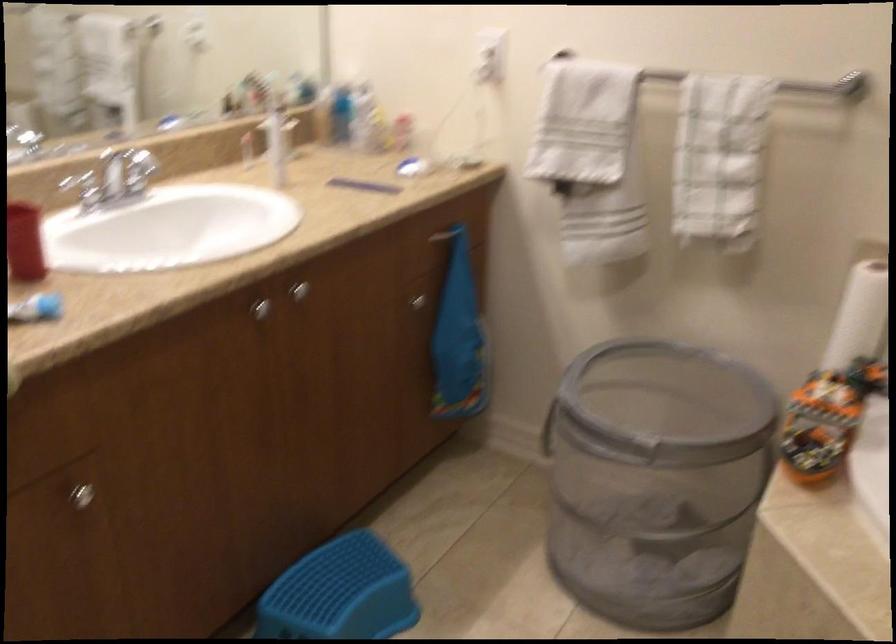
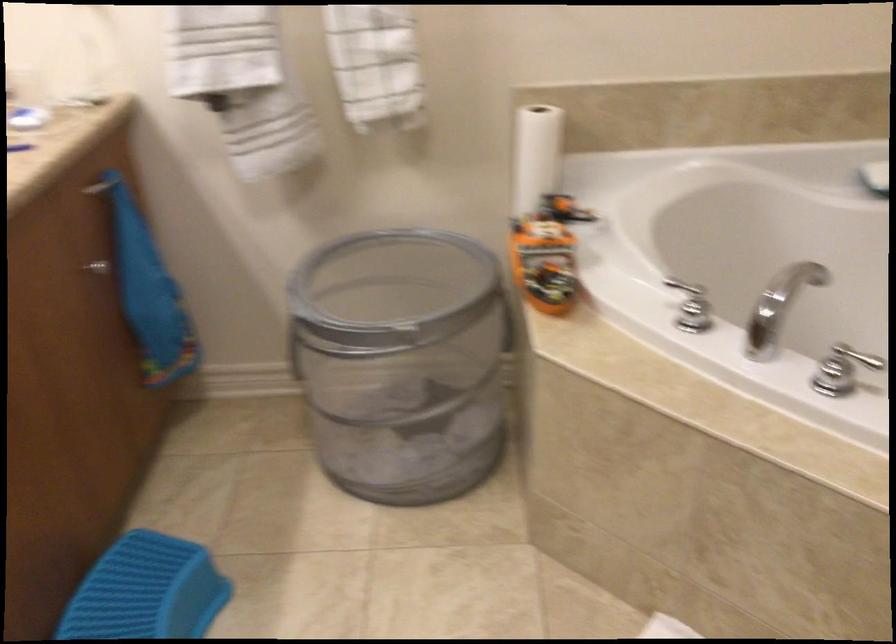
Question: The first image is from the beginning of the video and the second image is from the end. How did the camera likely rotate when shooting the video?

Choices:
 (A) Left
 (B) Right
 (C) Up
 (D) Down

Answer: (B)